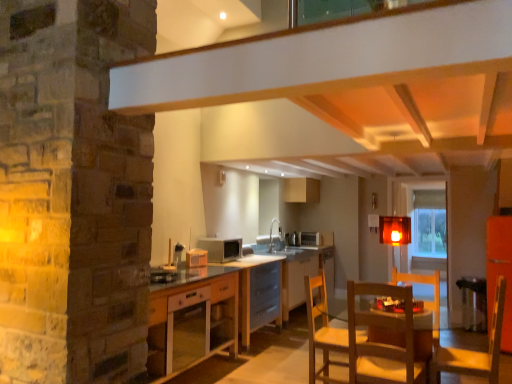
Question: Should I look upward or downward to see translucent amber cube at center?

Choices:
 (A) down
 (B) up

Answer: (B)

Question: Can we say translucent amber cube at center lies outside wooden table at center, which ranks as the second table in front-to-back order?

Choices:
 (A) no
 (B) yes

Answer: (B)

Question: From a real-world perspective, is translucent amber cube at center positioned over wooden table at center, which ranks as the second table in front-to-back order, based on gravity?

Choices:
 (A) no
 (B) yes

Answer: (B)

Question: Does translucent amber cube at center turn towards wooden table at center, which ranks as the second table in front-to-back order?

Choices:
 (A) yes
 (B) no

Answer: (B)

Question: Is translucent amber cube at center at the right side of wooden table at center, which ranks as the second table in front-to-back order?

Choices:
 (A) yes
 (B) no

Answer: (A)

Question: From a real-world perspective, is translucent amber cube at center physically below wooden table at center, placed as the 1th table when sorted from back to front?

Choices:
 (A) yes
 (B) no

Answer: (B)

Question: Does translucent amber cube at center have a larger size compared to wooden table at center, which ranks as the second table in front-to-back order?

Choices:
 (A) yes
 (B) no

Answer: (B)

Question: Is transparent glass door at right turned away from wooden table at center, which ranks as the second table in back-to-front order?

Choices:
 (A) yes
 (B) no

Answer: (B)

Question: Can you confirm if transparent glass door at right is bigger than wooden table at center, which ranks as the second table in back-to-front order?

Choices:
 (A) yes
 (B) no

Answer: (B)

Question: Would you say wooden table at center, which ranks as the second table in back-to-front order, is part of transparent glass door at right's contents?

Choices:
 (A) no
 (B) yes

Answer: (A)

Question: Is transparent glass door at right smaller than wooden table at center, placed as the first table when sorted from front to back?

Choices:
 (A) no
 (B) yes

Answer: (B)

Question: Is transparent glass door at right thinner than wooden table at center, which ranks as the second table in back-to-front order?

Choices:
 (A) no
 (B) yes

Answer: (B)

Question: Does transparent glass door at right turn towards wooden table at center, placed as the first table when sorted from front to back?

Choices:
 (A) no
 (B) yes

Answer: (A)

Question: Would you say metallic silver bar stool at lower right is part of wooden table at center, which ranks as the second table in back-to-front order,'s contents?

Choices:
 (A) no
 (B) yes

Answer: (A)